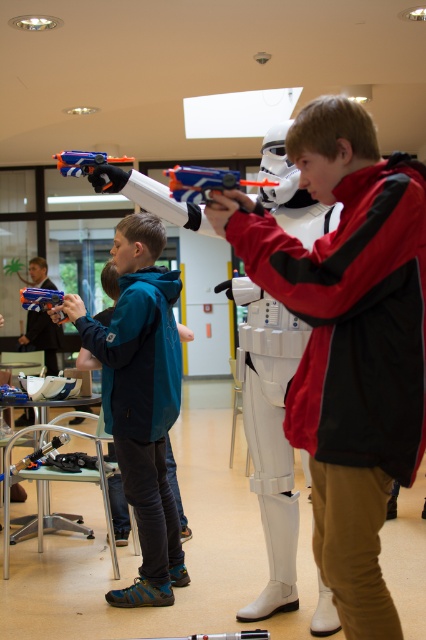
You are a photographer trying to capture the two children holding toy blasters in the scene. The first child is at point (374, 316) and the second child is at point (29, 298). From your position at the entrance, which child should you focus on first to ensure you capture them in the correct order based on their positions?

You should focus on the child at point (374, 316) first because they are in front of the child at point (29, 298).

You are a photographer positioned at the camera. You want to capture a closeup shot of the matte black jacket at center. Can you get within 5 feet to take the photo?

The matte black jacket at center is 5.22 feet away from camera, so yes, you can get within 5 feet to take the photo since it is just slightly beyond 5 feet.

In the scene shown: You are standing at the entrance of the room and want to locate the matte black jacket at center. According to the coordinates provided, in which general direction should you look to find it?

The matte black jacket at center is located at coordinates point (348, 340), which places it in the central area of the image. Since you are at the entrance, you should look towards the center of the room to find it.